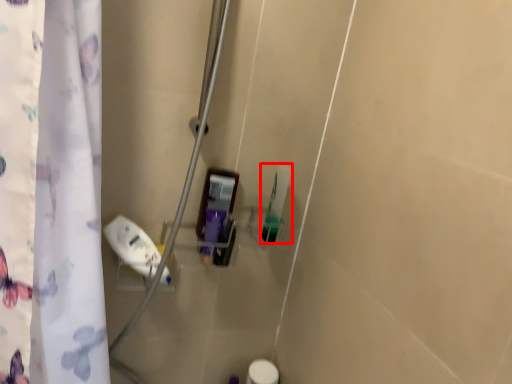
Question: From the image's perspective, where is toiletry (annotated by the red box) located in relation to toiletry in the image?

Choices:
 (A) above
 (B) below

Answer: (A)